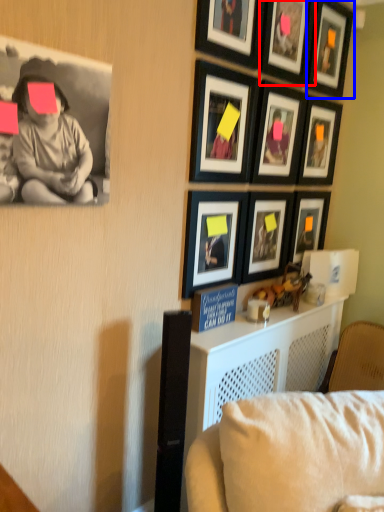
Question: Which of the following is the closest to the observer, picture frame (highlighted by a red box) or picture frame (highlighted by a blue box)?

Choices:
 (A) picture frame
 (B) picture frame

Answer: (A)